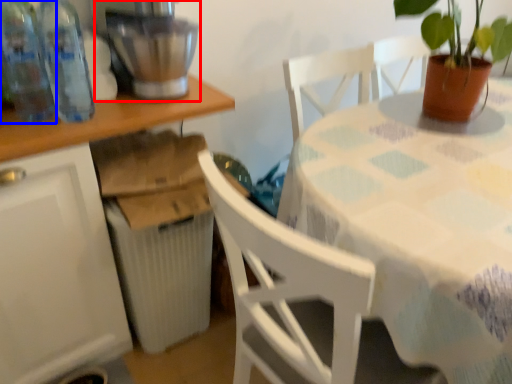
Question: Which object appears closest to the camera in this image, mixer (highlighted by a red box) or bottle (highlighted by a blue box)?

Choices:
 (A) mixer
 (B) bottle

Answer: (B)